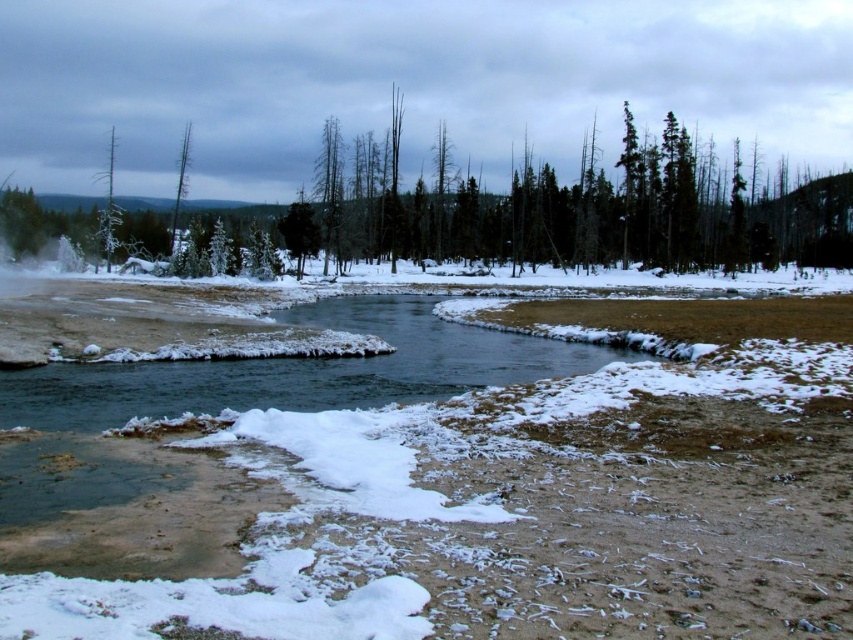
Is point (105, 221) behind point (175, 224)?

No, (105, 221) is in front of (175, 224).

Which is more to the left, frosty bark tree at upper left or dead wood tree at upper left?

Positioned to the left is frosty bark tree at upper left.

The image size is (853, 640). I want to click on frosty bark tree at upper left, so click(x=108, y=209).

Where is `frosty bark tree at upper left`? This screenshot has height=640, width=853. frosty bark tree at upper left is located at coordinates (108, 209).

Where is `green matte tree at upper center`? green matte tree at upper center is located at coordinates (570, 211).

Can you confirm if green matte tree at upper center is thinner than dead wood tree at upper left?

No.

Locate an element on the screen. The image size is (853, 640). green matte tree at upper center is located at coordinates (570, 211).

Is green matte tree at upper center taller than frosty bark tree at upper left?

Indeed, green matte tree at upper center has a greater height compared to frosty bark tree at upper left.

Which is above, green matte tree at upper center or frosty bark tree at upper left?

green matte tree at upper center is higher up.

Is point (561, 253) less distant than point (97, 236)?

No, (561, 253) is further to viewer.

Identify the location of green matte tree at upper center. The width and height of the screenshot is (853, 640). (570, 211).